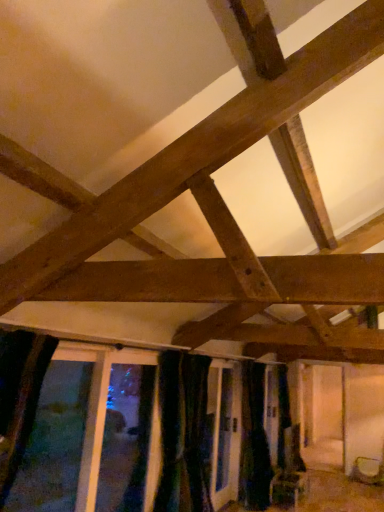
Question: Considering the positions of point (84, 415) and point (377, 483), is point (84, 415) closer or farther from the camera than point (377, 483)?

Choices:
 (A) closer
 (B) farther

Answer: (A)

Question: Based on their sizes in the image, would you say transparent glass window at lower left is bigger or smaller than matte brown basket at lower right?

Choices:
 (A) big
 (B) small

Answer: (A)

Question: Which of these objects is positioned closest to the transparent glass window at lower left?

Choices:
 (A) matte brown basket at lower right
 (B) black fabric curtain at lower center

Answer: (B)

Question: Which object is the farthest from the transparent glass window at lower left?

Choices:
 (A) black fabric curtain at lower center
 (B) matte brown basket at lower right

Answer: (B)